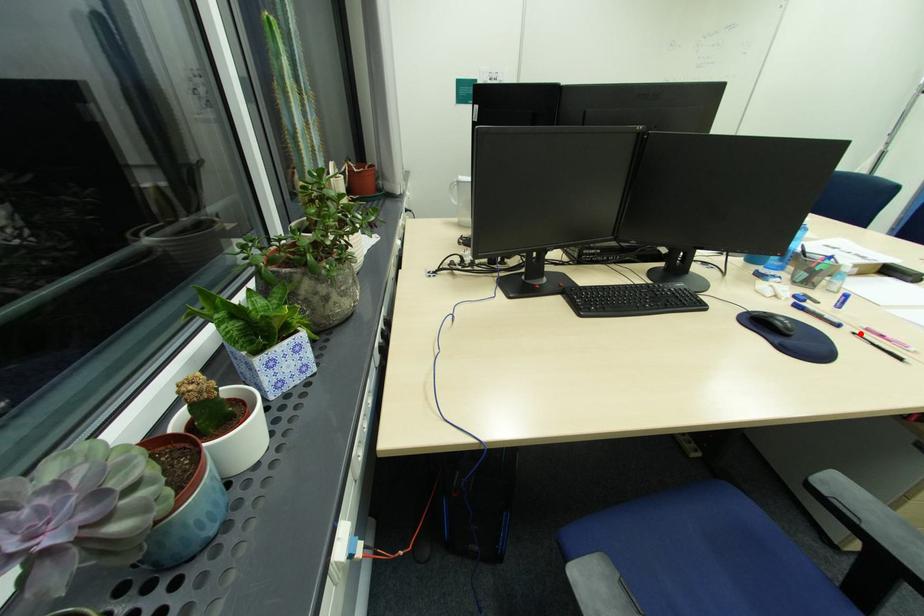
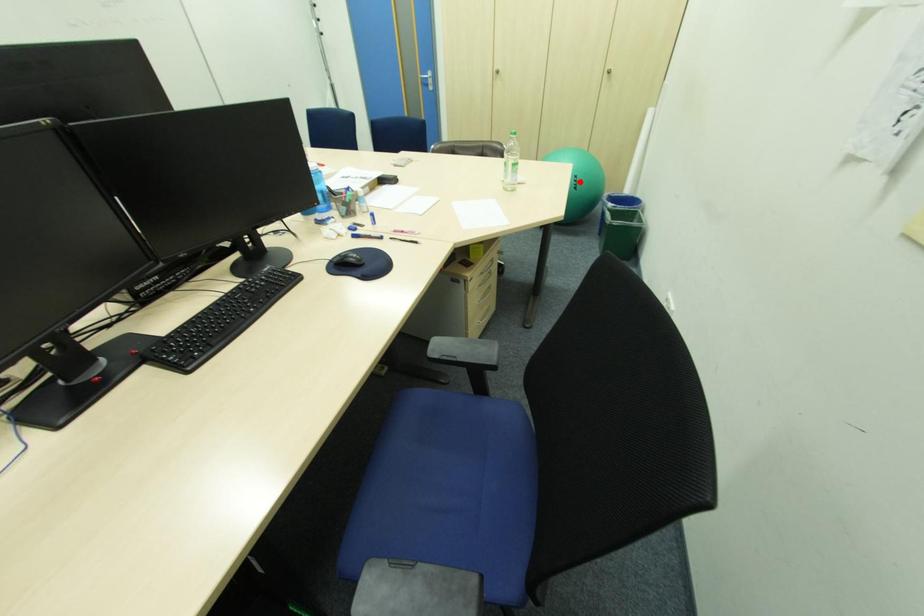
I am providing you with two images of the same scene from different viewpoints. A red point is marked on the first image and another point is marked on the second image. Does the point marked in image1 correspond to the same location as the one in image2?

No